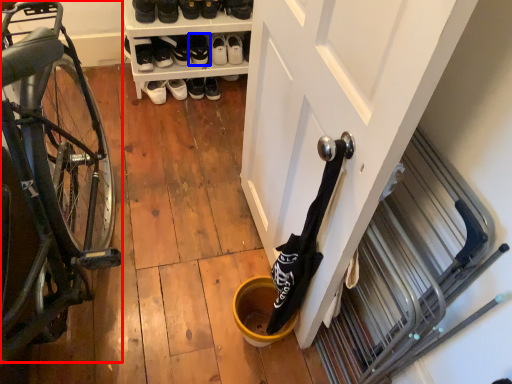
Question: Among these objects, which one is nearest to the camera, bicycle (highlighted by a red box) or footwear (highlighted by a blue box)?

Choices:
 (A) bicycle
 (B) footwear

Answer: (A)